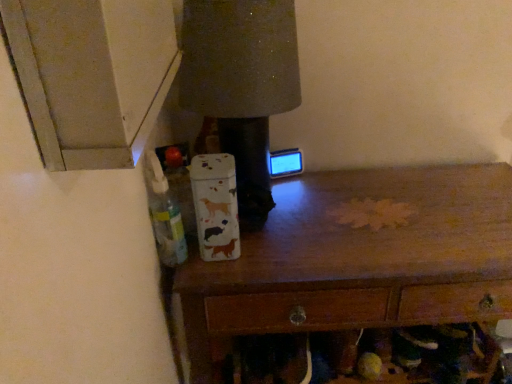
Question: Considering the relative sizes of translucent plastic bottle at left and wooden chest of drawers at center in the image provided, is translucent plastic bottle at left bigger than wooden chest of drawers at center?

Choices:
 (A) no
 (B) yes

Answer: (A)

Question: Is translucent plastic bottle at left not near wooden chest of drawers at center?

Choices:
 (A) no
 (B) yes

Answer: (A)

Question: Is translucent plastic bottle at left further to camera compared to wooden chest of drawers at center?

Choices:
 (A) yes
 (B) no

Answer: (B)

Question: Is translucent plastic bottle at left facing towards wooden chest of drawers at center?

Choices:
 (A) no
 (B) yes

Answer: (A)

Question: From the image's perspective, does translucent plastic bottle at left appear higher than wooden chest of drawers at center?

Choices:
 (A) yes
 (B) no

Answer: (A)

Question: Is translucent plastic bottle at left smaller than wooden chest of drawers at center?

Choices:
 (A) yes
 (B) no

Answer: (A)

Question: Can you confirm if wooden chest of drawers at center is positioned to the left of translucent plastic bottle at left?

Choices:
 (A) yes
 (B) no

Answer: (B)

Question: Is wooden chest of drawers at center outside of translucent plastic bottle at left?

Choices:
 (A) no
 (B) yes

Answer: (B)

Question: Can you confirm if wooden chest of drawers at center is smaller than translucent plastic bottle at left?

Choices:
 (A) no
 (B) yes

Answer: (A)

Question: Considering the relative sizes of wooden chest of drawers at center and translucent plastic bottle at left in the image provided, is wooden chest of drawers at center shorter than translucent plastic bottle at left?

Choices:
 (A) no
 (B) yes

Answer: (A)

Question: Is wooden chest of drawers at center further to the viewer compared to translucent plastic bottle at left?

Choices:
 (A) no
 (B) yes

Answer: (B)

Question: Is wooden chest of drawers at center next to translucent plastic bottle at left and touching it?

Choices:
 (A) yes
 (B) no

Answer: (B)

Question: Considering the positions of wooden chest of drawers at center and translucent plastic bottle at left in the image, is wooden chest of drawers at center bigger or smaller than translucent plastic bottle at left?

Choices:
 (A) big
 (B) small

Answer: (A)